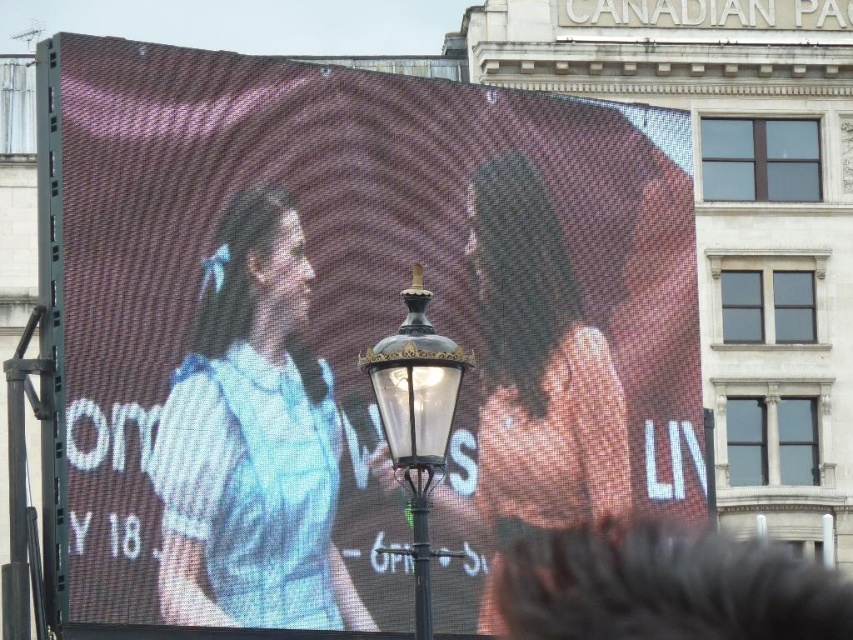
From the picture: You are a passerby standing on the sidewalk in front of the pixelated digital billboard at center and the blue cotton shirt at left. Which object is higher up in the scene?

The pixelated digital billboard at center is positioned over the blue cotton shirt at left, meaning it is higher up in the scene.

You are standing at the origin point of a coordinate system placed over the image. The origin is at the bottom left corner of the image. The x and y axes increase to the right and up, respectively. You need to determine the location of the pixelated digital billboard at center. What are its coordinates?

The pixelated digital billboard at center is located at coordinates approximately at point (345, 330).

You are a photographer standing in front of the pixelated digital billboard at center and the blue cotton shirt at left. You want to capture a photo that includes both objects in the frame. Considering their sizes, which object should you focus on to ensure both are visible?

The pixelated digital billboard at center is taller than the blue cotton shirt at left, so focusing on the billboard will allow both objects to fit in the frame since it is the larger object.